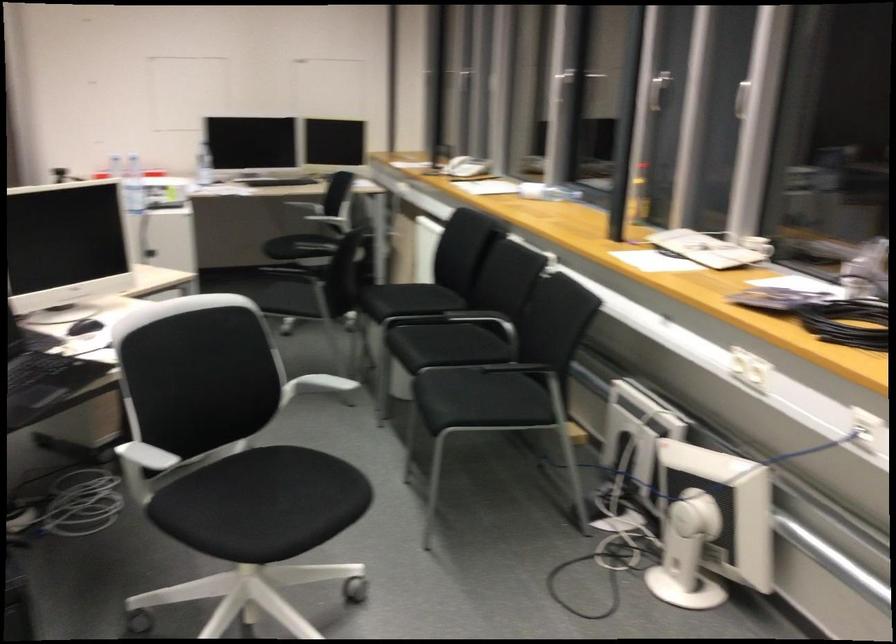
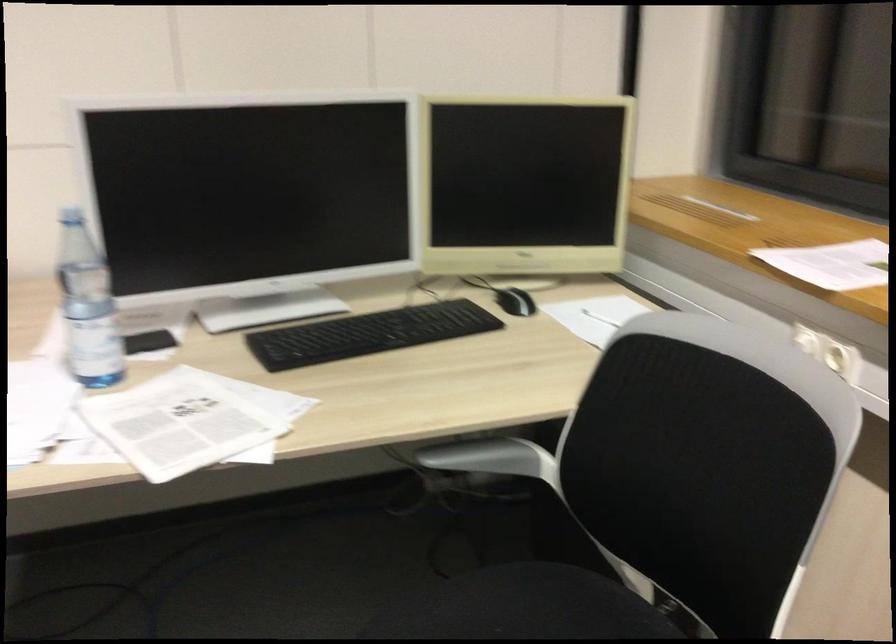
Question: In a continuous first-person perspective shot, in which direction is the camera moving?

Choices:
 (A) Left
 (B) Right
 (C) Forward
 (D) Backward

Answer: (C)